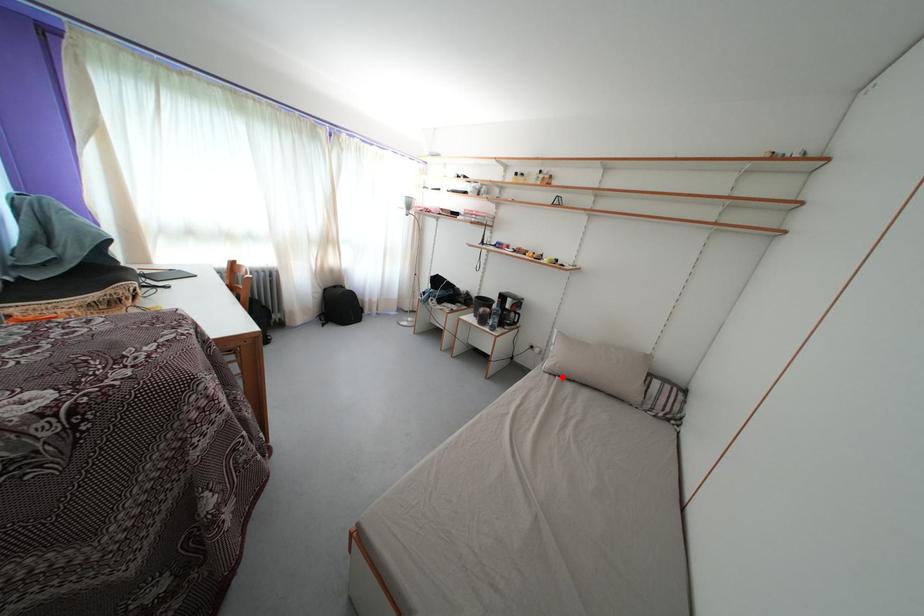
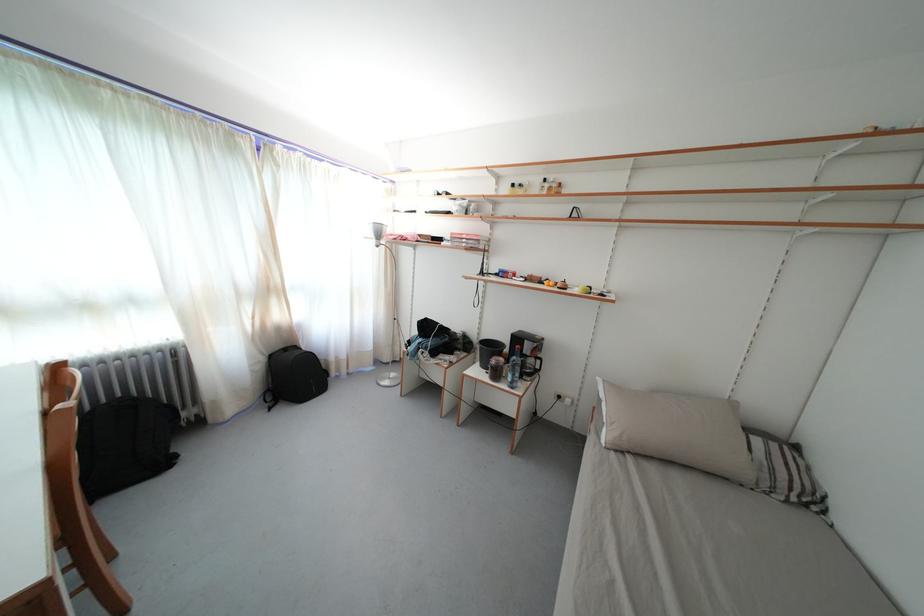
Question: I am providing you with two images of the same scene from different viewpoints. Image1 has a red point marked. In image2, the corresponding 3D location appears at what relative position? Reply with the corresponding letter.

Choices:
 (A) Closer
 (B) Farther

Answer: (B)